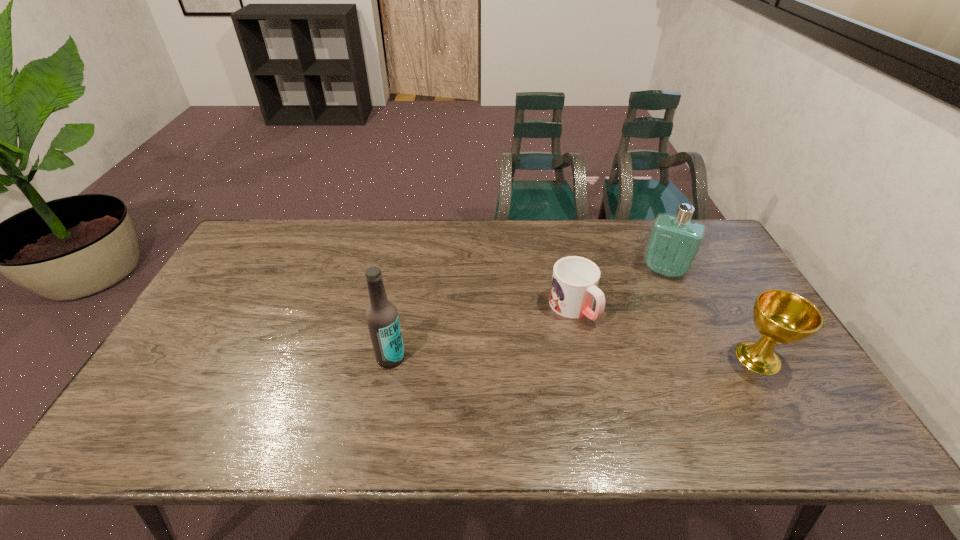
Locate an element on the screen. The height and width of the screenshot is (540, 960). beer bottle is located at coordinates (382, 318).

Image resolution: width=960 pixels, height=540 pixels. I want to click on the tallest object, so click(382, 318).

This screenshot has width=960, height=540. In order to click on chalice in this screenshot , I will do `click(783, 317)`.

The width and height of the screenshot is (960, 540). I want to click on the second object from left to right, so click(574, 287).

The image size is (960, 540). I want to click on mug, so click(x=574, y=287).

Image resolution: width=960 pixels, height=540 pixels. What are the coordinates of `perfume` in the screenshot? It's located at (674, 241).

At what (x,y) coordinates should I click in order to perform the action: click on the second tallest object. Please return your answer as a coordinate pair (x, y). The image size is (960, 540). Looking at the image, I should click on (674, 241).

This screenshot has width=960, height=540. What are the coordinates of `vacant space located 0.140m on the left of the third tallest object` in the screenshot? It's located at (678, 357).

This screenshot has height=540, width=960. In order to click on free spot located 0.290m on the side of the third nearest object with the handle in this screenshot , I will do `click(667, 408)`.

The image size is (960, 540). I want to click on free spot located 0.190m on the side of the third nearest object with the handle, so click(x=637, y=377).